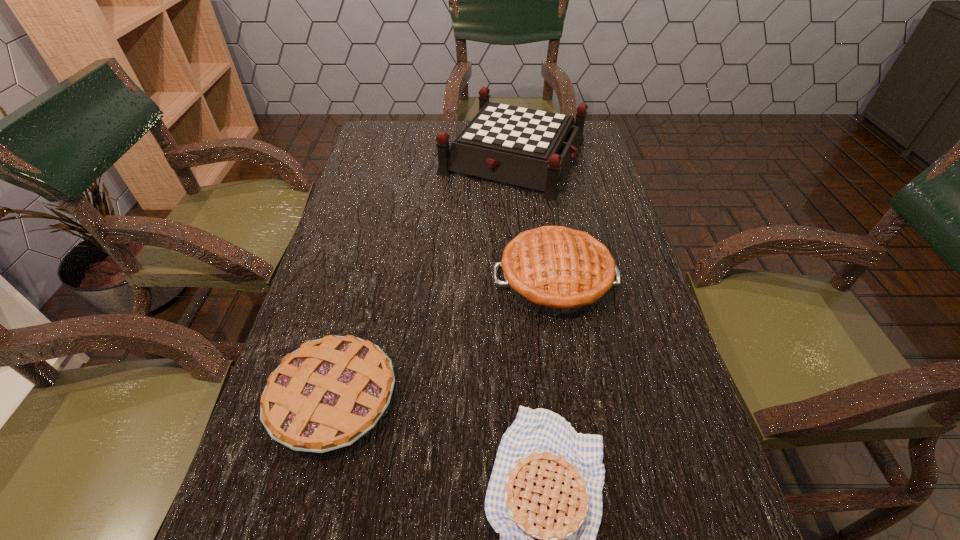
I want to click on the farthest object, so click(530, 148).

At what (x,y) coordinates should I click in order to perform the action: click on the tallest object. Please return your answer as a coordinate pair (x, y). This screenshot has height=540, width=960. Looking at the image, I should click on (530, 148).

Locate an element on the screen. the farthest pie is located at coordinates (553, 270).

At what (x,y) coordinates should I click in order to perform the action: click on the tallest pie. Please return your answer as a coordinate pair (x, y). Looking at the image, I should click on (553, 270).

At what (x,y) coordinates should I click in order to perform the action: click on the leftmost object. Please return your answer as a coordinate pair (x, y). The image size is (960, 540). Looking at the image, I should click on (325, 395).

Locate an element on the screen. blank area located on the front of the tallest object is located at coordinates (519, 213).

Find the location of a particular element. This screenshot has height=540, width=960. vacant space located on the back of the tallest pie is located at coordinates (537, 168).

Identify the location of vacant point located on the right of the leftmost object. The width and height of the screenshot is (960, 540). click(532, 397).

Locate an element on the screen. This screenshot has width=960, height=540. object at the far edge is located at coordinates (530, 148).

I want to click on object that is at the left edge, so click(325, 395).